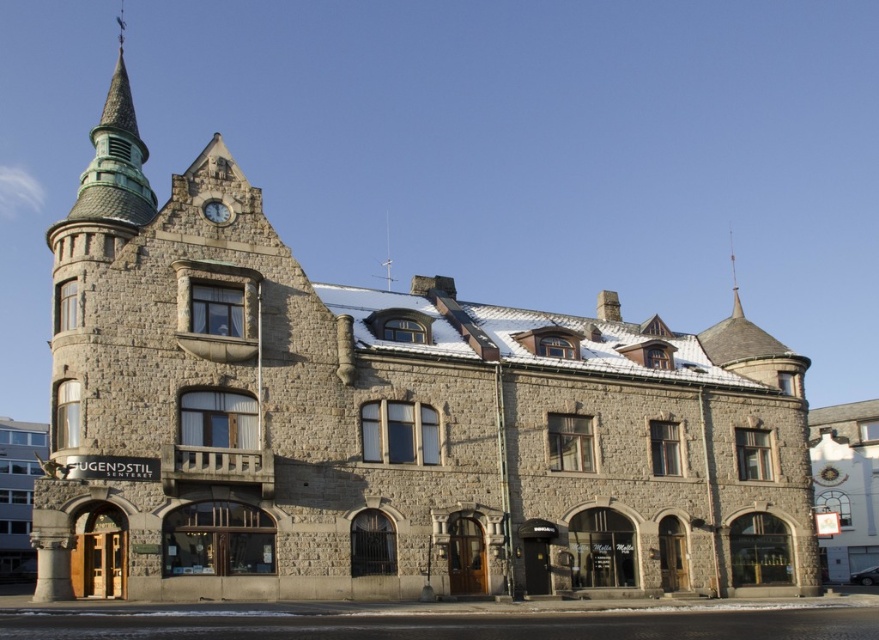
Is point (91, 182) closer to viewer compared to point (30, 500)?

That is True.

Which of these two, green copper spire at upper left or stone building at left, stands taller?

green copper spire at upper left

Does point (134, 164) come in front of point (20, 444)?

Yes, it is in front of point (20, 444).

Locate an element on the screen. This screenshot has height=640, width=879. green copper spire at upper left is located at coordinates (115, 157).

In the scene shown: Does matte gray clock at upper center have a greater height compared to shiny metallic spire at upper center?

No.

Is point (222, 202) less distant than point (735, 276)?

Yes, point (222, 202) is closer to viewer.

Where is `matte gray clock at upper center`? matte gray clock at upper center is located at coordinates (216, 211).

Does green copper spire at upper left have a greater height compared to matte gray clock at upper center?

Yes.

Can you confirm if green copper spire at upper left is bigger than matte gray clock at upper center?

Correct, green copper spire at upper left is larger in size than matte gray clock at upper center.

Does point (135, 200) come closer to viewer compared to point (216, 224)?

No, it is behind (216, 224).

Image resolution: width=879 pixels, height=640 pixels. Identify the location of green copper spire at upper left. (115, 157).